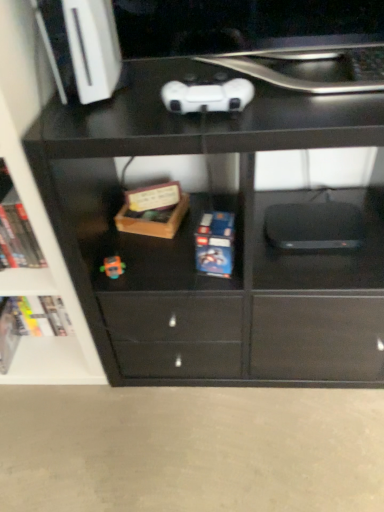
At what (x,y) coordinates should I click in order to perform the action: click on free space in front of white matte game controller at upper center. Please return your answer as a coordinate pair (x, y). This screenshot has height=512, width=384. Looking at the image, I should click on (220, 127).